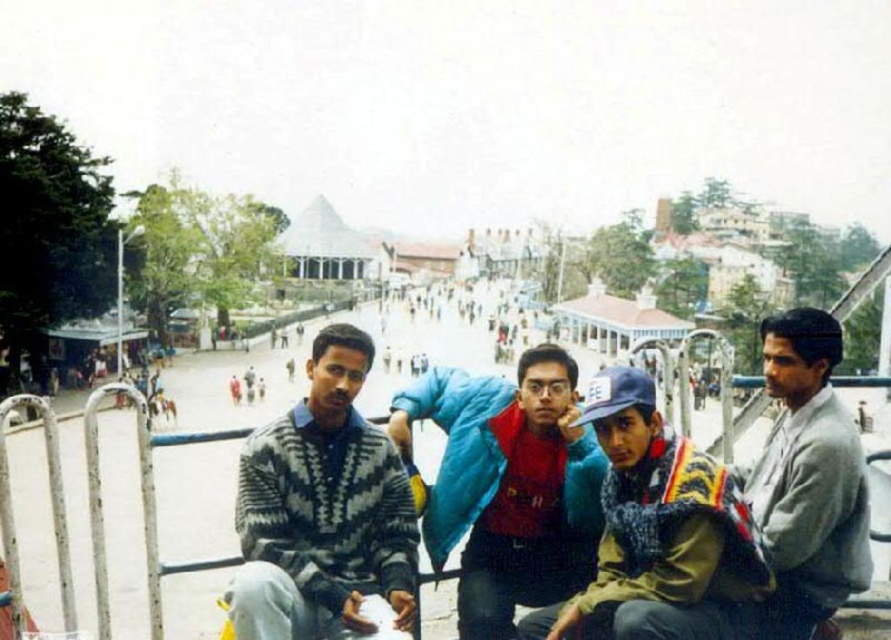
Question: Which of the following is the closest to the observer?

Choices:
 (A) multicolored patchwork jacket at center
 (B) gray and white knitted sweater at center
 (C) gray wool sweater at right
 (D) blue fuzzy jacket at center

Answer: (A)

Question: Does blue fuzzy jacket at center have a smaller size compared to multicolored patchwork jacket at center?

Choices:
 (A) yes
 (B) no

Answer: (B)

Question: Which point is closer to the camera taking this photo?

Choices:
 (A) (693, 492)
 (B) (786, 608)
 (C) (309, 474)
 (D) (519, 538)

Answer: (B)

Question: Can you confirm if gray and white knitted sweater at center is positioned to the right of multicolored patchwork jacket at center?

Choices:
 (A) yes
 (B) no

Answer: (B)

Question: Is blue fuzzy jacket at center to the left of gray wool sweater at right from the viewer's perspective?

Choices:
 (A) yes
 (B) no

Answer: (A)

Question: Among these points, which one is farthest from the camera?

Choices:
 (A) (589, 579)
 (B) (609, 461)
 (C) (838, 440)

Answer: (B)